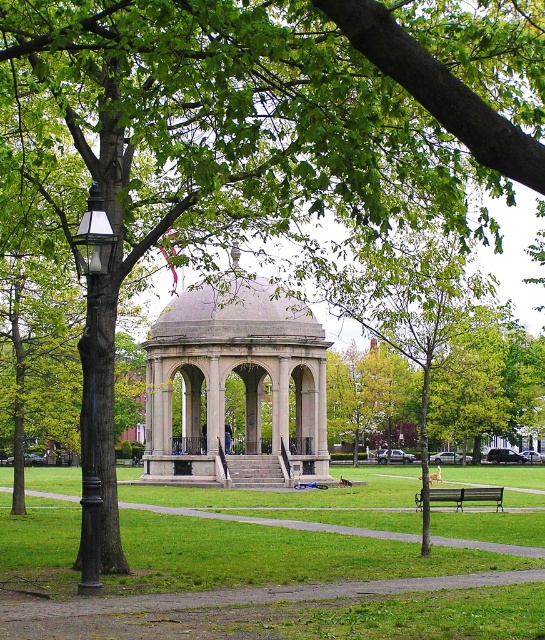
Is green grass at center further to camera compared to black glass lamp post at left?

No, green grass at center is closer to the viewer.

Does green grass at center have a lesser width compared to black glass lamp post at left?

No.

Is point (243, 532) farther from camera compared to point (94, 289)?

Yes, it is behind point (94, 289).

Find the location of a particular element. green grass at center is located at coordinates (276, 556).

Between gray stone gazebo at center and black glass lamp post at left, which one is positioned higher?

black glass lamp post at left

Is point (308, 476) behind point (95, 476)?

Yes, point (308, 476) is farther from viewer.

Image resolution: width=545 pixels, height=640 pixels. Identify the location of gray stone gazebo at center. (243, 385).

Is gray stone gazebo at center closer to camera compared to green wooden bench at lower right?

No, gray stone gazebo at center is further to the viewer.

Between gray stone gazebo at center and green wooden bench at lower right, which one is positioned lower?

green wooden bench at lower right is below.

Between point (147, 384) and point (459, 492), which one is positioned behind?

The point (147, 384) is more distant.

Identify the location of gray stone gazebo at center. (243, 385).